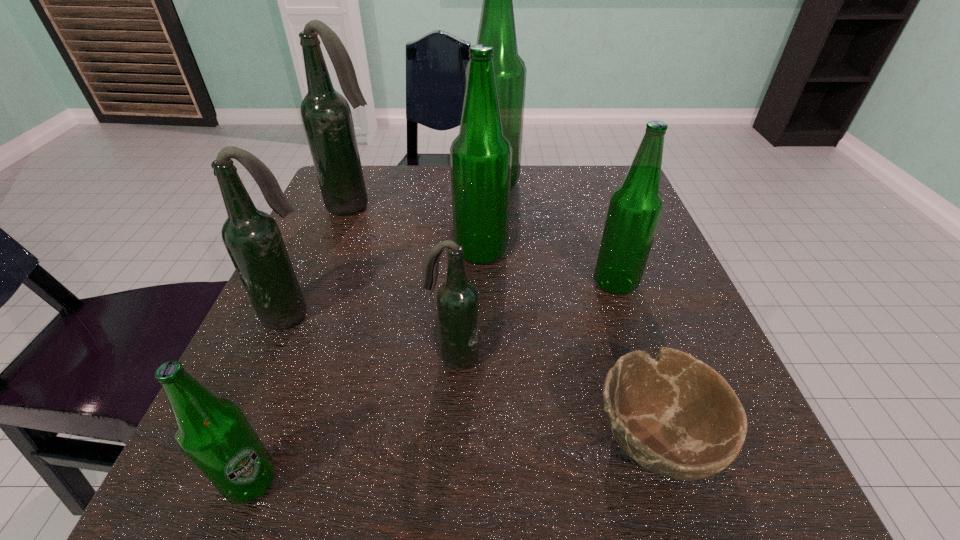
The height and width of the screenshot is (540, 960). In order to click on empty space that is in between the shortest object and the smallest green beer bottle in this screenshot , I will do `click(453, 460)`.

Find the location of a particular element. free space between the farthest dark beer bottle and the second nearest dark beer bottle is located at coordinates (323, 260).

Image resolution: width=960 pixels, height=540 pixels. In order to click on vacant space in between the second farthest green beer bottle and the shortest object in this screenshot , I will do `click(567, 345)`.

Find the location of `vacant region between the second farthest dark beer bottle and the third farthest beer bottle`. vacant region between the second farthest dark beer bottle and the third farthest beer bottle is located at coordinates (386, 283).

I want to click on free space between the shortest object and the second farthest dark beer bottle, so click(x=472, y=376).

Where is `vacant region between the biggest dark beer bottle and the sixth farthest beer bottle`? Image resolution: width=960 pixels, height=540 pixels. vacant region between the biggest dark beer bottle and the sixth farthest beer bottle is located at coordinates (404, 281).

This screenshot has width=960, height=540. I want to click on vacant region between the second smallest green beer bottle and the nearest green beer bottle, so click(x=433, y=382).

The height and width of the screenshot is (540, 960). In order to click on empty space that is in between the farthest dark beer bottle and the nearest green beer bottle in this screenshot , I will do `click(303, 343)`.

Where is `the fifth closest object to the farthest dark beer bottle`? The height and width of the screenshot is (540, 960). the fifth closest object to the farthest dark beer bottle is located at coordinates (636, 206).

Select which object is the closest to the second nearest beer bottle. Please provide its 2D coordinates. Your answer should be formatted as a tuple, i.e. [(x, y)], where the tuple contains the x and y coordinates of a point satisfying the conditions above.

[(674, 415)]